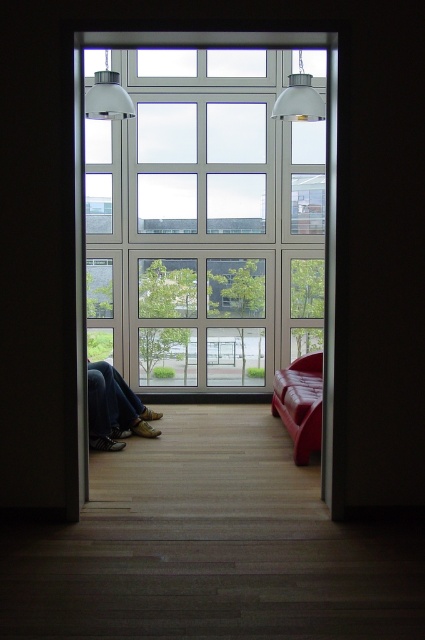
Question: Considering the real-world distances, which object is farthest from the clear glass window at center?

Choices:
 (A) leather couch at right
 (B) leather shoes at lower left

Answer: (A)

Question: Is clear glass window at center to the left of leather shoes at lower left from the viewer's perspective?

Choices:
 (A) yes
 (B) no

Answer: (B)

Question: Which point is farther from the camera taking this photo?

Choices:
 (A) click(292, 195)
 (B) click(289, 372)
 (C) click(104, 428)

Answer: (A)

Question: Is clear glass window at center thinner than leather couch at right?

Choices:
 (A) no
 (B) yes

Answer: (A)

Question: Is clear glass window at center smaller than leather shoes at lower left?

Choices:
 (A) no
 (B) yes

Answer: (A)

Question: Which point is farther to the camera?

Choices:
 (A) clear glass window at center
 (B) leather couch at right
 (C) leather shoes at lower left

Answer: (A)